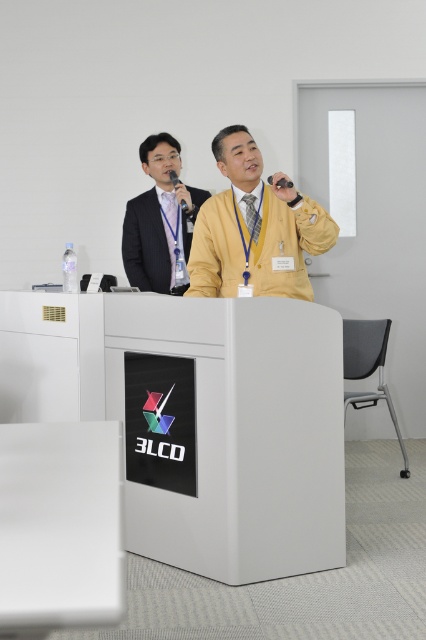
Question: From the image, what is the correct spatial relationship of yellow matte jacket at center in relation to matte black suit at upper left?

Choices:
 (A) below
 (B) above

Answer: (A)

Question: Which of the following is the farthest from the observer?

Choices:
 (A) white matte table at center
 (B) yellow matte jacket at center
 (C) black matte microphone at upper center

Answer: (B)

Question: Which of the following is the farthest from the observer?

Choices:
 (A) (238, 189)
 (B) (281, 184)
 (C) (238, 314)

Answer: (A)

Question: Which object is farther from the camera taking this photo?

Choices:
 (A) matte black microphone at upper center
 (B) white matte table at center

Answer: (A)

Question: Can you confirm if matte black suit at upper left is thinner than black matte microphone at upper center?

Choices:
 (A) no
 (B) yes

Answer: (A)

Question: Is yellow matte jacket at center further to camera compared to matte black suit at upper left?

Choices:
 (A) no
 (B) yes

Answer: (A)